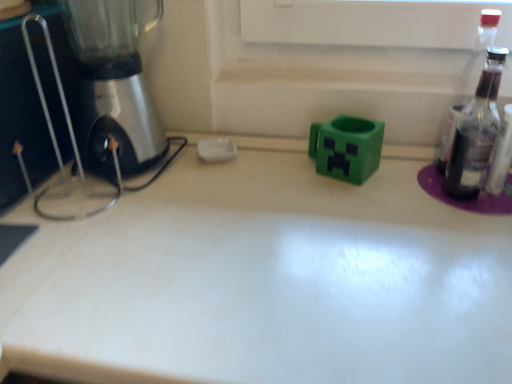
The height and width of the screenshot is (384, 512). In order to click on free point to the left of green matte plastic mug at center in this screenshot , I will do `click(264, 182)`.